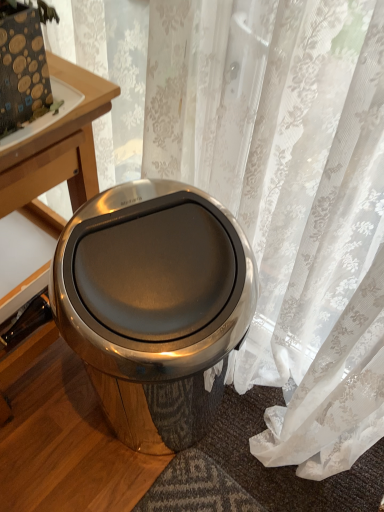
Question: Is polished stainless steel trash can at center positioned with its back to wooden table at upper left?

Choices:
 (A) yes
 (B) no

Answer: (B)

Question: Can you confirm if polished stainless steel trash can at center is taller than wooden table at upper left?

Choices:
 (A) yes
 (B) no

Answer: (A)

Question: From the image's perspective, is polished stainless steel trash can at center on top of wooden table at upper left?

Choices:
 (A) yes
 (B) no

Answer: (B)

Question: Is polished stainless steel trash can at center not inside wooden table at upper left?

Choices:
 (A) no
 (B) yes

Answer: (B)

Question: Are polished stainless steel trash can at center and wooden table at upper left beside each other?

Choices:
 (A) yes
 (B) no

Answer: (B)

Question: Could wooden table at upper left be considered to be inside polished stainless steel trash can at center?

Choices:
 (A) yes
 (B) no

Answer: (B)

Question: Considering the relative sizes of translucent floral curtain at center and wooden table at left in the image provided, is translucent floral curtain at center smaller than wooden table at left?

Choices:
 (A) yes
 (B) no

Answer: (A)

Question: Does translucent floral curtain at center have a lesser height compared to wooden table at left?

Choices:
 (A) yes
 (B) no

Answer: (B)

Question: Could wooden table at left be considered to be inside translucent floral curtain at center?

Choices:
 (A) no
 (B) yes

Answer: (A)

Question: Is translucent floral curtain at center completely or partially outside of wooden table at left?

Choices:
 (A) yes
 (B) no

Answer: (A)

Question: Is translucent floral curtain at center to the left of wooden table at left from the viewer's perspective?

Choices:
 (A) yes
 (B) no

Answer: (B)

Question: From a real-world perspective, is translucent floral curtain at center physically above wooden table at left?

Choices:
 (A) no
 (B) yes

Answer: (B)

Question: From a real-world perspective, is wooden table at left over polished stainless steel trash can at center?

Choices:
 (A) no
 (B) yes

Answer: (B)